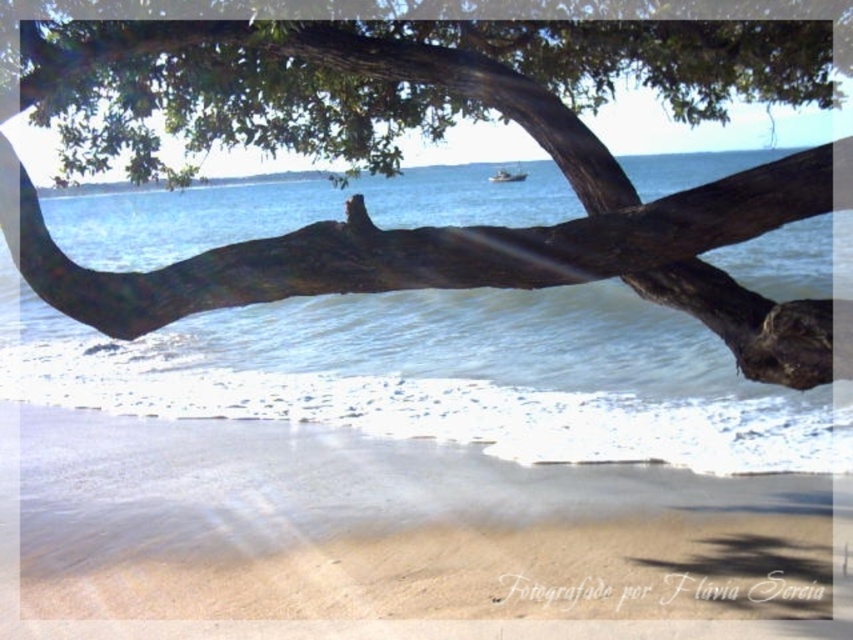
You are a photographer trying to capture the metallic silver boat at center in your shot. There is a smooth brown branch at upper center that might block the view. Based on the scene description, will the branch block the boat in your photo?

The smooth brown branch at upper center is positioned on the left side of metallic silver boat at center, so it will not block the boat in your photo.

In the scene shown: You are standing on the sandy beach at lower center and want to walk to the metallic silver boat at center. Which direction should you move to reach the boat?

You should move forward because the metallic silver boat at center is positioned further away from the observer than the sandy beach at lower center, so moving forward from the sandy beach at lower center will lead you towards the boat.

You are standing at the point marked by the coordinates point (434, 132), which is located at the smooth brown branch at upper center. From this position, which direction would you face to look towards the distant landmass on the horizon?

The smooth brown branch at upper center is located at point (434, 132). Since the horizon with the distant landmass is typically at the far end of the scene, facing away from the branch towards the open water would align you with the distant landmass.